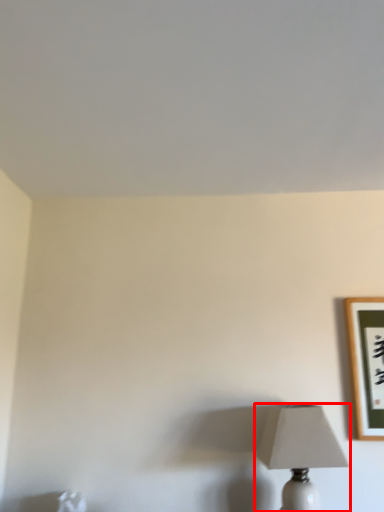
Question: From the image's perspective, what is the correct spatial relationship of lamp (annotated by the red box) in relation to picture frame?

Choices:
 (A) above
 (B) below

Answer: (B)